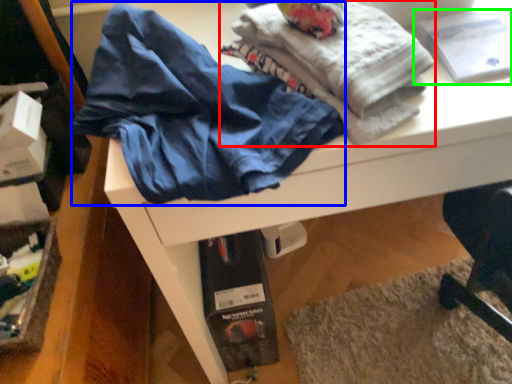
Question: Considering the real-world distances, which object is farthest from fabric (highlighted by a red box)? clothing (highlighted by a blue box) or book (highlighted by a green box)?

Choices:
 (A) clothing
 (B) book

Answer: (B)